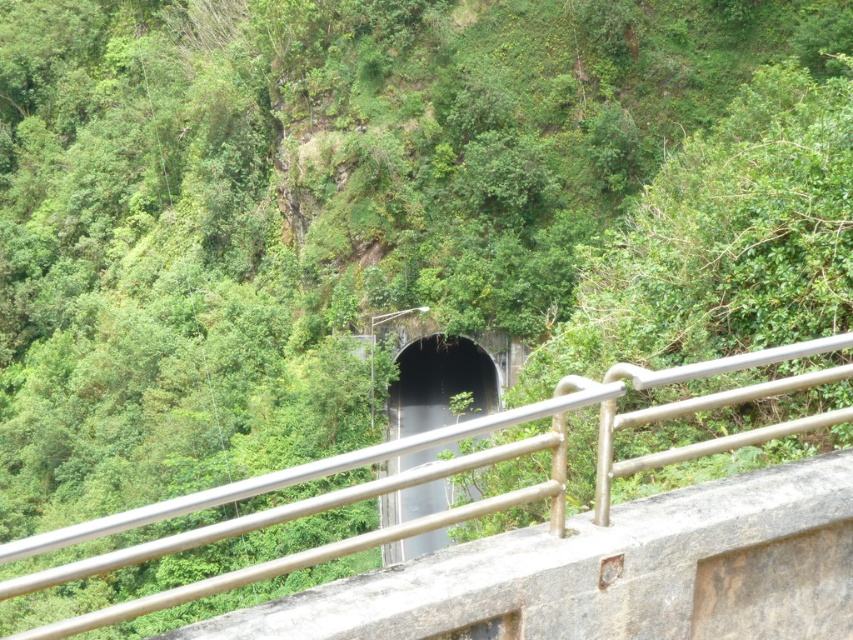
Identify the location of metallic gray rail at center. The width and height of the screenshot is (853, 640). (422, 481).

Looking at this image, who is positioned more to the right, metallic gray rail at center or black concrete tunnel at center?

metallic gray rail at center

Is point (770, 433) farther from camera compared to point (405, 544)?

No, it is in front of (405, 544).

Where is `metallic gray rail at center`? The height and width of the screenshot is (640, 853). metallic gray rail at center is located at coordinates (422, 481).